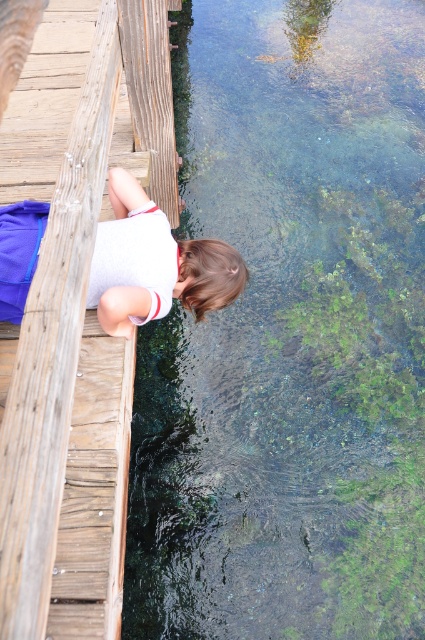
Which is more to the right, clear water at lower left or white matte shirt at upper left?

From the viewer's perspective, clear water at lower left appears more on the right side.

Is point (367, 42) closer to viewer compared to point (167, 307)?

No, it is not.

Find the location of `clear water at lower left`. clear water at lower left is located at coordinates (289, 336).

Can you confirm if wooden dock at left is positioned to the left of white matte shirt at upper left?

No, wooden dock at left is not to the left of white matte shirt at upper left.

Is wooden dock at left bigger than white matte shirt at upper left?

Correct, wooden dock at left is larger in size than white matte shirt at upper left.

Does point (76, 316) come behind point (25, 264)?

That is False.

Locate an element on the screen. wooden dock at left is located at coordinates pos(74,310).

Which is more to the right, clear water at lower left or wooden dock at left?

Positioned to the right is clear water at lower left.

Is the position of clear water at lower left less distant than that of wooden dock at left?

That is False.

Which is behind, point (252, 243) or point (11, 108)?

Positioned behind is point (252, 243).

Locate an element on the screen. The width and height of the screenshot is (425, 640). clear water at lower left is located at coordinates (289, 336).